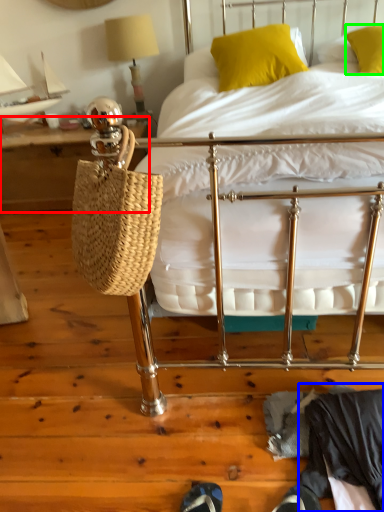
Question: Which object is positioned closest to table (highlighted by a red box)? Select from clothing (highlighted by a blue box) and pillow (highlighted by a green box).

Choices:
 (A) clothing
 (B) pillow

Answer: (B)